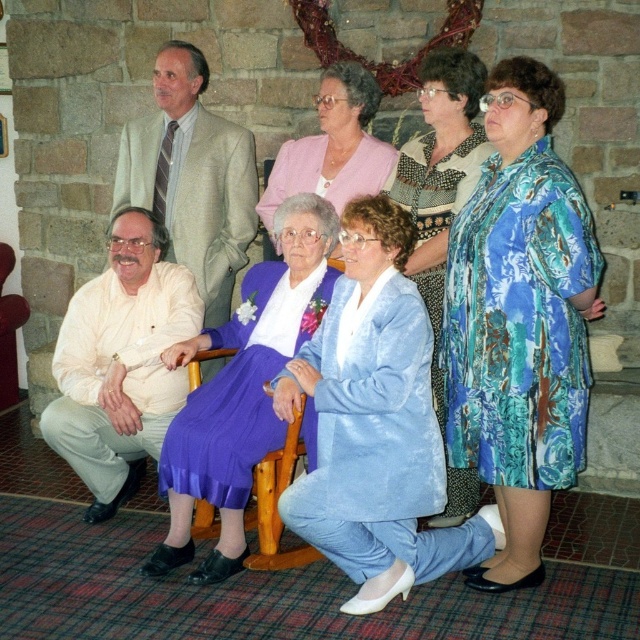
Question: Which is nearer to the pink satin dress at center?

Choices:
 (A) light blue satin suit at center
 (B) blue floral dress at center

Answer: (B)

Question: Based on their relative distances, which object is nearer to the white matte shirt at lower left?

Choices:
 (A) floral print dress at right
 (B) light beige suit at upper left

Answer: (B)

Question: Is purple satin skirt at center further to the viewer compared to light beige suit at upper left?

Choices:
 (A) yes
 (B) no

Answer: (B)

Question: Which of the following is the farthest from the observer?

Choices:
 (A) (426, 67)
 (B) (173, 52)

Answer: (B)

Question: Is floral print dress at right wider than white matte shirt at lower left?

Choices:
 (A) no
 (B) yes

Answer: (A)

Question: Is light blue satin suit at center wider than pink satin dress at center?

Choices:
 (A) no
 (B) yes

Answer: (B)